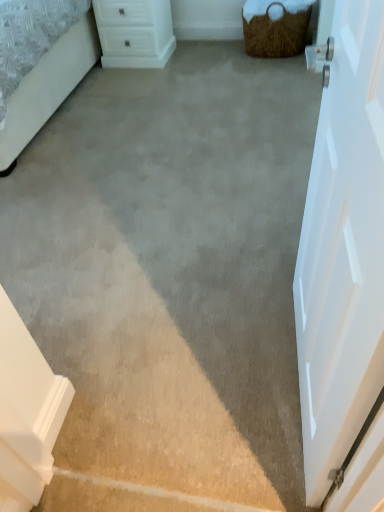
Question: Is white smooth door at right inside the boundaries of white plastic chest of drawers at upper center, or outside?

Choices:
 (A) outside
 (B) inside

Answer: (A)

Question: Considering the positions of white smooth door at right and white plastic chest of drawers at upper center in the image, is white smooth door at right bigger or smaller than white plastic chest of drawers at upper center?

Choices:
 (A) small
 (B) big

Answer: (A)

Question: Estimate the real-world distances between objects in this image. Which object is farther from the white plastic chest of drawers at upper center?

Choices:
 (A) white smooth door at right
 (B) brown woven basket at upper right

Answer: (A)

Question: Which is nearer to the brown woven basket at upper right?

Choices:
 (A) white plastic chest of drawers at upper center
 (B) white smooth door at right

Answer: (A)